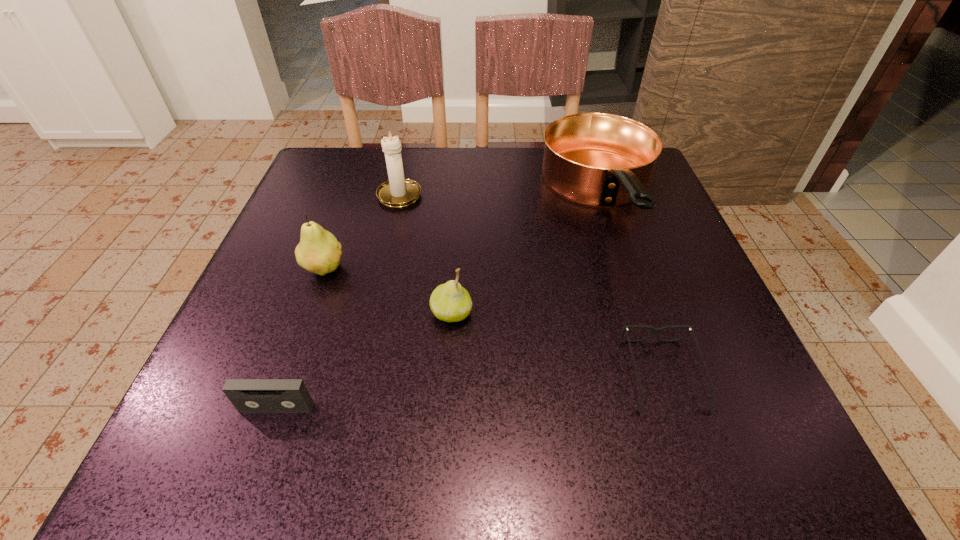
The height and width of the screenshot is (540, 960). Identify the location of free space located 0.100m on the handle side of the candle holder. 408,157.

Locate an element on the screen. The height and width of the screenshot is (540, 960). blank area located 0.330m on the front of the left pear is located at coordinates (252, 469).

You are a GUI agent. You are given a task and a screenshot of the screen. Output one action in this format:
    pyautogui.click(x=<x>, y=<y>)
    Task: Click on the vacant area located on the left of the right pear
    The width and height of the screenshot is (960, 540).
    Given the screenshot: What is the action you would take?
    pyautogui.click(x=354, y=313)

This screenshot has height=540, width=960. What are the coordinates of `free space located 0.080m on the front-facing side of the videotape` in the screenshot? It's located at (254, 471).

This screenshot has height=540, width=960. Identify the location of vacant space located with the lenses facing outward on the spectacles. (690, 457).

I want to click on frying pan at the far edge, so click(x=597, y=159).

Locate an element on the screen. candle holder that is positioned at the far edge is located at coordinates (397, 192).

Where is `videotape situated at the near edge`? This screenshot has width=960, height=540. videotape situated at the near edge is located at coordinates click(247, 395).

You are a GUI agent. You are given a task and a screenshot of the screen. Output one action in this format:
    pyautogui.click(x=<x>, y=<y>)
    Task: Click on the spectacles situated at the near edge
    
    Given the screenshot: What is the action you would take?
    pyautogui.click(x=654, y=330)

Where is `pear that is at the left edge`? pear that is at the left edge is located at coordinates click(319, 252).